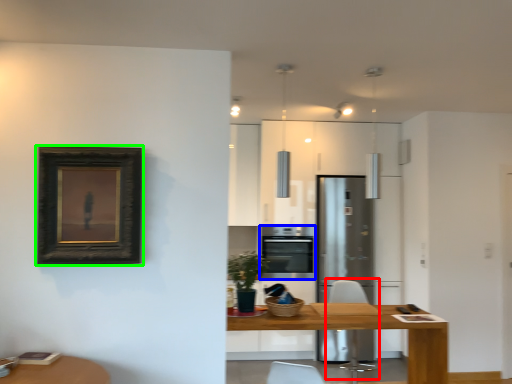
Question: Based on their relative distances, which object is farther from swivel chair (highlighted by a red box)? Choose from oven (highlighted by a blue box) and picture frame (highlighted by a green box).

Choices:
 (A) oven
 (B) picture frame

Answer: (B)